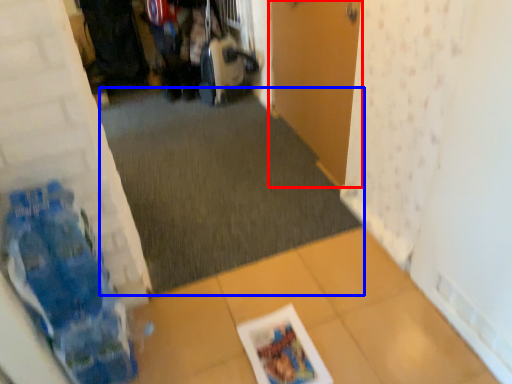
Question: Among these objects, which one is nearest to the camera, door (highlighted by a red box) or plain (highlighted by a blue box)?

Choices:
 (A) door
 (B) plain

Answer: (A)